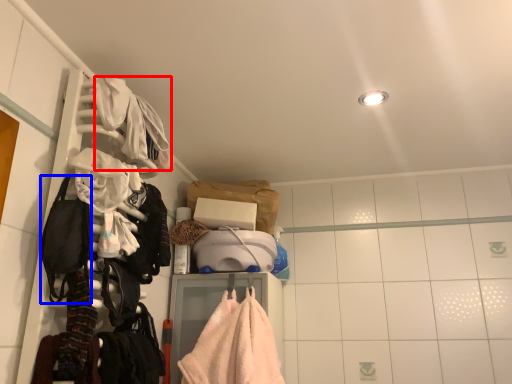
Question: Which point is further to the camera, clothing (highlighted by a red box) or gear (highlighted by a blue box)?

Choices:
 (A) clothing
 (B) gear

Answer: (A)